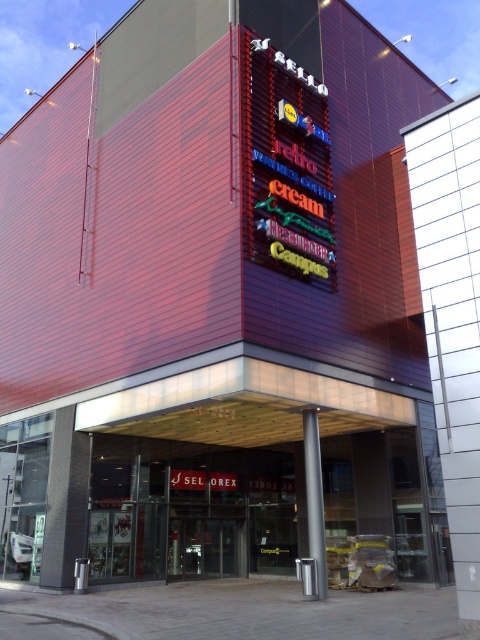
You are a delivery person standing 10 meters away from the building. You need to deliver a package to the office located behind the neon signboard at center. Can you throw the package to the office without crossing the transparent glass doors at center?

The distance between the neon signboard at center and the transparent glass doors at center is 13.01 meters. Since you are already 10 meters away from the building, the total distance from you to the neon signboard at center would be more than 13.01 meters. Therefore, you cannot throw the package to the office without crossing the transparent glass doors at center.

You are a delivery person trying to enter the building through the transparent glass doors at center. The neon signboard at center is blocking your path. Can you go through the doors without moving the signboard?

The neon signboard at center is positioned over transparent glass doors at center, so it is above the doors and not blocking the entrance path. You can go through the transparent glass doors at center without moving the signboard.